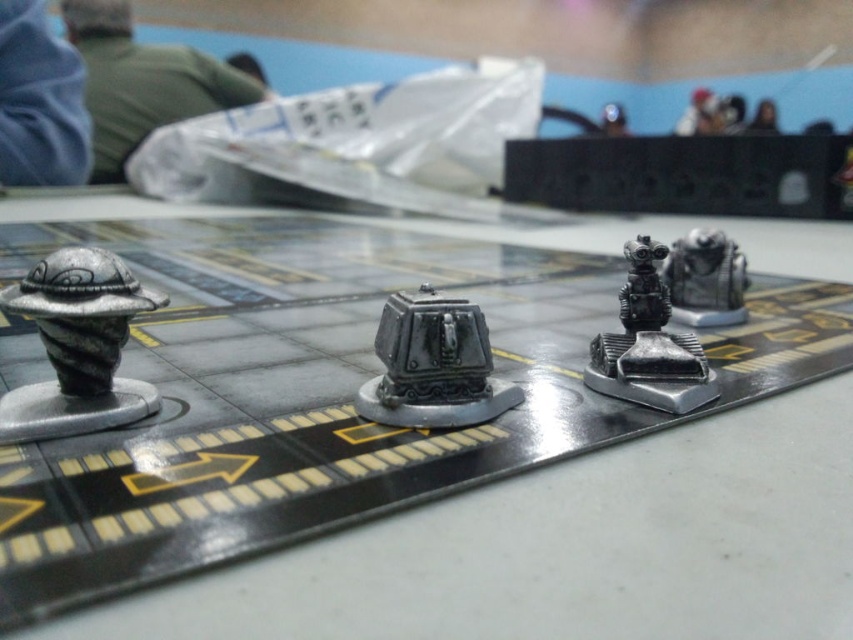
You are playing a tabletop game and need to move your pieces. You have a metallic silver robot at center and a silver metallic spaceship at left. Which piece is positioned higher on the board?

The metallic silver robot at center is positioned higher on the board than the silver metallic spaceship at left because it is placed above it.

You are a player in a tabletop game and need to move your pieces. You have a metallic silver robot at center and a silver metallic spaceship at left. Which of your pieces can you move further if the board allows movement based on size, with larger pieces moving more spaces?

The metallic silver robot at center is bigger than the silver metallic spaceship at left, so it can move further on the board.

You are playing a tabletop game and need to move your pieces. You have a silver metallic spaceship at left and a metallic robot at center. Which object is positioned more to the left side of the board?

The silver metallic spaceship at left is positioned more to the left side of the board than the metallic robot at center.